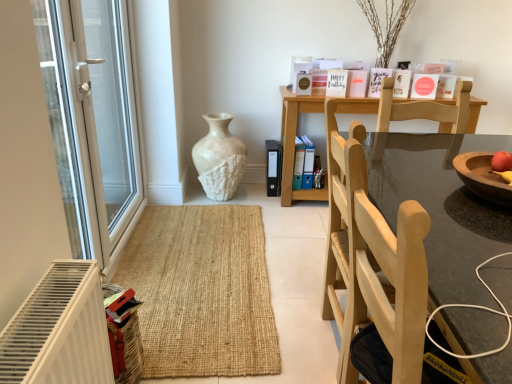
Question: Does wooden round table at center come in front of white textured vase at center?

Choices:
 (A) no
 (B) yes

Answer: (B)

Question: Is wooden round table at center looking in the opposite direction of white textured vase at center?

Choices:
 (A) yes
 (B) no

Answer: (B)

Question: From the image's perspective, is wooden round table at center located beneath white textured vase at center?

Choices:
 (A) no
 (B) yes

Answer: (B)

Question: Is white textured vase at center completely or partially inside wooden round table at center?

Choices:
 (A) no
 (B) yes

Answer: (A)

Question: Can you confirm if wooden round table at center is smaller than white textured vase at center?

Choices:
 (A) yes
 (B) no

Answer: (B)

Question: Based on their sizes in the image, would you say wooden round table at center is bigger or smaller than white textured vase at center?

Choices:
 (A) big
 (B) small

Answer: (A)

Question: Is wooden round table at center inside or outside of white textured vase at center?

Choices:
 (A) inside
 (B) outside

Answer: (B)

Question: From the image's perspective, relative to white textured vase at center, is wooden round table at center above or below?

Choices:
 (A) above
 (B) below

Answer: (B)

Question: Based on their positions, is wooden round table at center located to the left or right of white textured vase at center?

Choices:
 (A) left
 (B) right

Answer: (B)

Question: Is wooden round table at center bigger or smaller than transparent glass door at left?

Choices:
 (A) small
 (B) big

Answer: (A)

Question: Is wooden round table at center spatially inside transparent glass door at left, or outside of it?

Choices:
 (A) inside
 (B) outside

Answer: (B)

Question: From a real-world perspective, relative to transparent glass door at left, is wooden round table at center vertically above or below?

Choices:
 (A) below
 (B) above

Answer: (A)

Question: From the image's perspective, relative to transparent glass door at left, is wooden round table at center above or below?

Choices:
 (A) below
 (B) above

Answer: (A)

Question: Do you think transparent glass door at left is within blue plastic file at center, which ranks as the second book in top-to-bottom order, or outside of it?

Choices:
 (A) outside
 (B) inside

Answer: (A)

Question: Is transparent glass door at left wider or thinner than blue plastic file at center, the first book positioned from the back?

Choices:
 (A) thin
 (B) wide

Answer: (B)